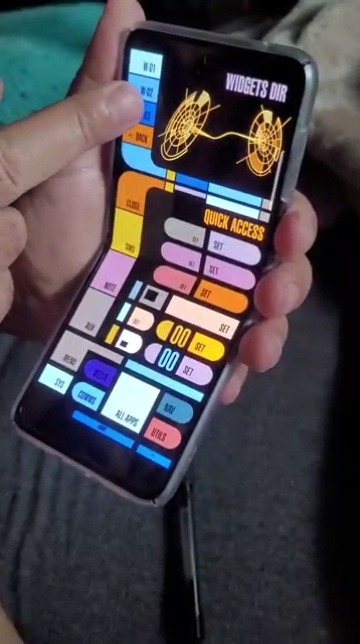
Locate an element on the screen. The image size is (360, 644). phone screen is located at coordinates (177, 71).